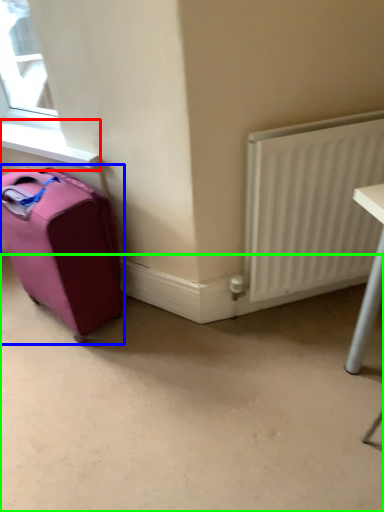
Question: Based on their relative distances, which object is nearer to window sill (highlighted by a red box)? Choose from luggage and bags (highlighted by a blue box) and concrete (highlighted by a green box).

Choices:
 (A) luggage and bags
 (B) concrete

Answer: (A)